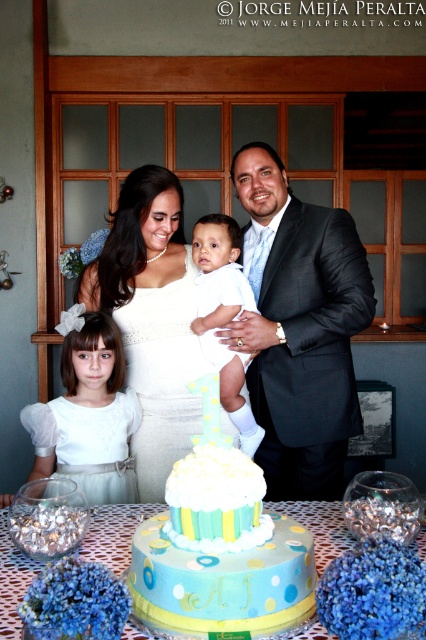
Question: Which point is closer to the camera taking this photo?

Choices:
 (A) (143, 605)
 (B) (101, 518)

Answer: (A)

Question: Which of the following is the closest to the observer?

Choices:
 (A) white satin dress at center
 (B) white satin dress at lower left

Answer: (B)

Question: Considering the real-world distances, which object is farthest from the white satin dress at lower left?

Choices:
 (A) blue polka dot cake at center
 (B) black suit at center
 (C) white soft fabric baby at center
 (D) white satin dress at center

Answer: (B)

Question: Does light blue fondant cake at center appear on the right side of white satin dress at lower left?

Choices:
 (A) no
 (B) yes

Answer: (B)

Question: Does light blue fondant cake at center have a lesser width compared to blue polka dot cake at center?

Choices:
 (A) yes
 (B) no

Answer: (A)

Question: Where is light blue fondant cake at center located in relation to blue polka dot cake at center in the image?

Choices:
 (A) left
 (B) right

Answer: (B)